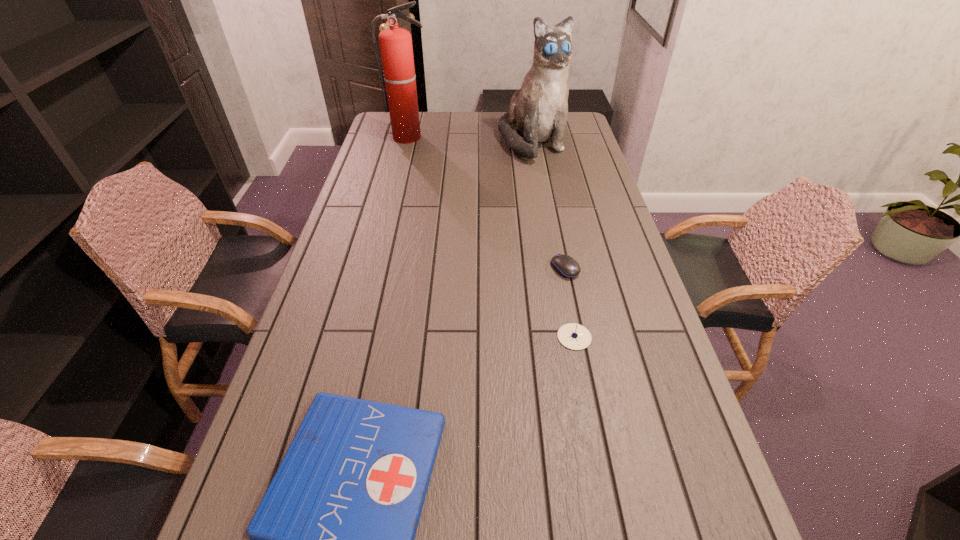
At what (x,y) coordinates should I click in order to perform the action: click on cat present at the far edge. Please return your answer as a coordinate pair (x, y). Looking at the image, I should click on (538, 112).

I want to click on object present at the left edge, so click(399, 75).

This screenshot has height=540, width=960. I want to click on object located at the right edge, so click(538, 112).

This screenshot has width=960, height=540. Find the location of `object located in the far left corner section of the desktop`. object located in the far left corner section of the desktop is located at coordinates (399, 75).

The height and width of the screenshot is (540, 960). Find the location of `object that is at the far right corner`. object that is at the far right corner is located at coordinates (538, 112).

The image size is (960, 540). I want to click on vacant space at the far edge, so click(455, 130).

You are a GUI agent. You are given a task and a screenshot of the screen. Output one action in this format:
    pyautogui.click(x=<x>, y=<y>)
    Task: Click on the free region at the left edge of the desktop
    The width and height of the screenshot is (960, 540).
    Given the screenshot: What is the action you would take?
    pyautogui.click(x=366, y=158)

The height and width of the screenshot is (540, 960). Find the location of `free space at the right edge of the desktop`. free space at the right edge of the desktop is located at coordinates (642, 356).

You are a GUI agent. You are given a task and a screenshot of the screen. Output one action in this format:
    pyautogui.click(x=<x>, y=<y>)
    Task: Click on the vacant space that is in between the fourth farthest object and the cat
    
    Given the screenshot: What is the action you would take?
    pyautogui.click(x=553, y=239)

Where is `vacant space that is in between the computer mouse and the fire extinguisher`? This screenshot has width=960, height=540. vacant space that is in between the computer mouse and the fire extinguisher is located at coordinates (487, 203).